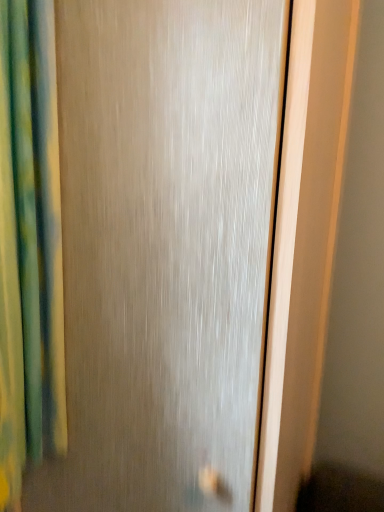
The height and width of the screenshot is (512, 384). Describe the element at coordinates (165, 246) in the screenshot. I see `matte wood door at center` at that location.

I want to click on matte wood door at center, so click(165, 246).

Where is `matte wood door at center`? The width and height of the screenshot is (384, 512). matte wood door at center is located at coordinates (165, 246).